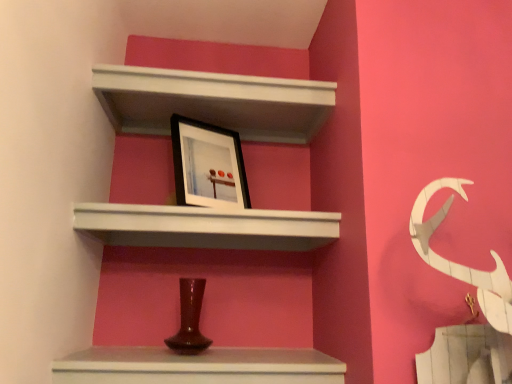
Question: Considering their positions, is matte brown vase at lower center located in front of or behind black matte picture frame at upper center?

Choices:
 (A) behind
 (B) front

Answer: (B)

Question: From their relative heights in the image, would you say matte brown vase at lower center is taller or shorter than black matte picture frame at upper center?

Choices:
 (A) short
 (B) tall

Answer: (A)

Question: Estimate the real-world distances between objects in this image. Which object is closer to the black matte picture frame at upper center?

Choices:
 (A) matte brown vase at lower center
 (B) white matte shelf at upper center, the second shelf from the bottom
 (C) white matte shelf at upper center, which is the 1th shelf from bottom to top

Answer: (C)

Question: Estimate the real-world distances between objects in this image. Which object is closer to the black matte picture frame at upper center?

Choices:
 (A) white matte shelf at upper center, which is the 1th shelf from bottom to top
 (B) matte brown vase at lower center
 (C) white matte shelf at upper center, which appears as the 1th shelf when viewed from the top

Answer: (A)